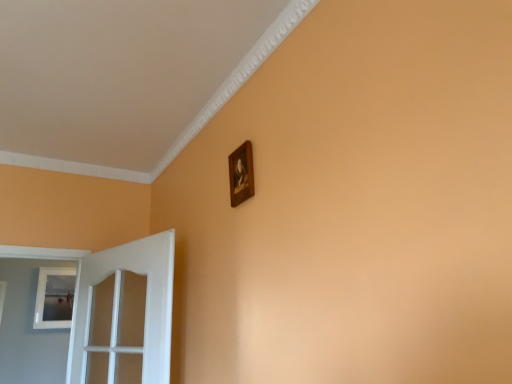
Question: From a real-world perspective, is wooden frame at upper center, which is the second picture frame in left-to-right order, under white glossy door at left?

Choices:
 (A) yes
 (B) no

Answer: (B)

Question: Is wooden frame at upper center, the first picture frame in the right-to-left sequence, at the right side of white glossy door at left?

Choices:
 (A) no
 (B) yes

Answer: (B)

Question: From the image's perspective, would you say wooden frame at upper center, which is the 2th picture frame from back to front, is shown under white glossy door at left?

Choices:
 (A) yes
 (B) no

Answer: (B)

Question: Is wooden frame at upper center, which is counted as the 1th picture frame, starting from the front, positioned in front of white glossy door at left?

Choices:
 (A) yes
 (B) no

Answer: (A)

Question: Is white glossy door at left at the back of wooden frame at upper center, the first picture frame in the top-to-bottom sequence?

Choices:
 (A) yes
 (B) no

Answer: (B)

Question: From the image's perspective, is wooden frame at upper center, which appears as the 2th picture frame when ordered from the bottom, over white glossy door at left?

Choices:
 (A) yes
 (B) no

Answer: (A)

Question: Is white matte picture frame at left, acting as the 1th picture frame starting from the bottom, positioned before wooden frame at upper center, which is the second picture frame in left-to-right order?

Choices:
 (A) yes
 (B) no

Answer: (B)

Question: From a real-world perspective, is white matte picture frame at left, which ranks as the second picture frame in front-to-back order, over wooden frame at upper center, which is counted as the 1th picture frame, starting from the front?

Choices:
 (A) yes
 (B) no

Answer: (B)

Question: Is white matte picture frame at left, which ranks as the 1th picture frame in left-to-right order, located outside wooden frame at upper center, which is the second picture frame in left-to-right order?

Choices:
 (A) no
 (B) yes

Answer: (B)

Question: Is white matte picture frame at left, acting as the 1th picture frame starting from the bottom, not close to wooden frame at upper center, the first picture frame in the top-to-bottom sequence?

Choices:
 (A) no
 (B) yes

Answer: (B)

Question: Would you say white matte picture frame at left, which ranks as the second picture frame in front-to-back order, contains wooden frame at upper center, the first picture frame in the right-to-left sequence?

Choices:
 (A) yes
 (B) no

Answer: (B)

Question: Does white matte picture frame at left, acting as the 1th picture frame starting from the bottom, have a greater height compared to wooden frame at upper center, which is counted as the 1th picture frame, starting from the front?

Choices:
 (A) yes
 (B) no

Answer: (A)

Question: From the image's perspective, does white matte picture frame at left, arranged as the 2th picture frame when viewed from the right, appear lower than white glossy door at left?

Choices:
 (A) no
 (B) yes

Answer: (B)